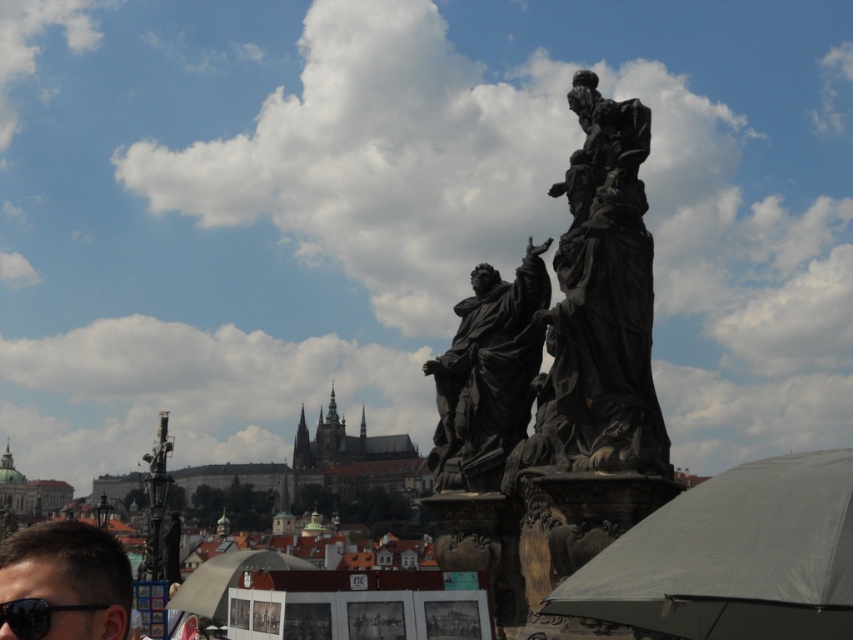
Question: Among these points, which one is farthest from the camera?

Choices:
 (A) (712, 589)
 (B) (22, 605)

Answer: (B)

Question: Does white matte umbrella at lower center appear under black plastic goggles at lower left?

Choices:
 (A) yes
 (B) no

Answer: (A)

Question: Which object appears farthest from the camera in this image?

Choices:
 (A) black plastic goggles at lower left
 (B) black stone statue at center
 (C) brown hair at lower left

Answer: (B)

Question: Considering the relative positions of white matte umbrella at lower center and black plastic goggles at lower left in the image provided, where is white matte umbrella at lower center located with respect to black plastic goggles at lower left?

Choices:
 (A) right
 (B) left

Answer: (B)

Question: Does white matte umbrella at lower center have a larger size compared to black plastic goggles at lower left?

Choices:
 (A) no
 (B) yes

Answer: (B)

Question: Which object is closer to the camera taking this photo?

Choices:
 (A) black stone statue at center
 (B) black plastic goggles at lower left
 (C) brown hair at lower left

Answer: (B)